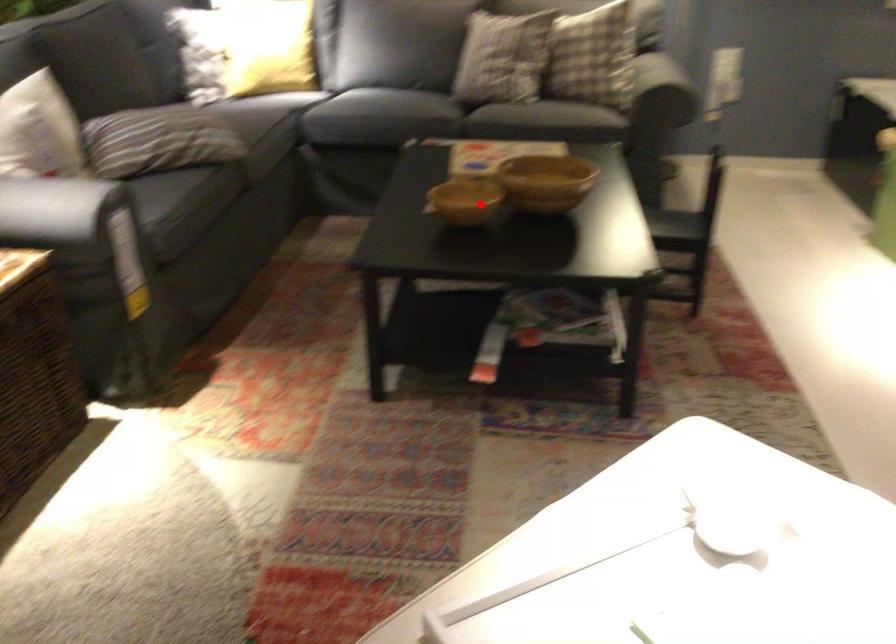
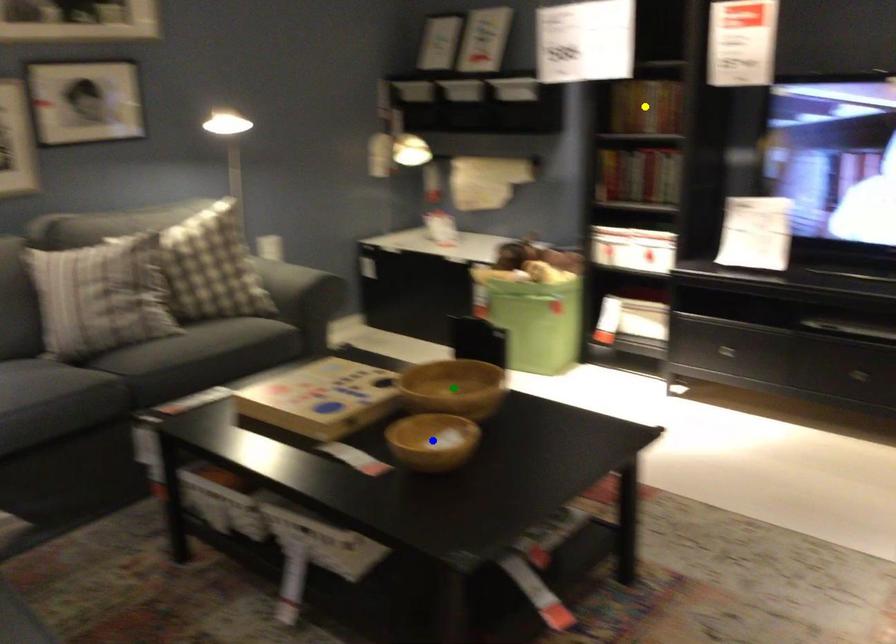
Question: I am providing you with two images of the same scene from different viewpoints. A red point is marked on the first image. You are given multiple points on the second image. Which point in image 2 represents the same 3d spot as the red point in image 1?

Choices:
 (A) yellow point
 (B) blue point
 (C) green point

Answer: (B)